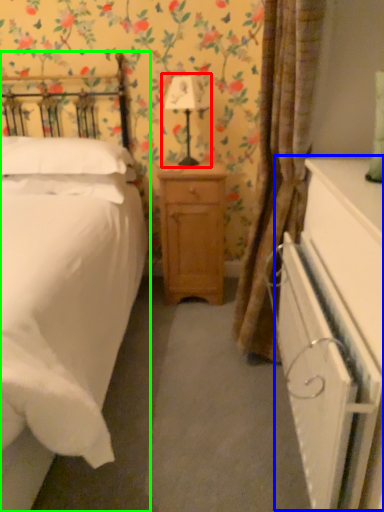
Question: Estimate the real-world distances between objects in this image. Which object is closer to bedside lamp (highlighted by a red box), dresser (highlighted by a blue box) or bed (highlighted by a green box)?

Choices:
 (A) dresser
 (B) bed

Answer: (B)